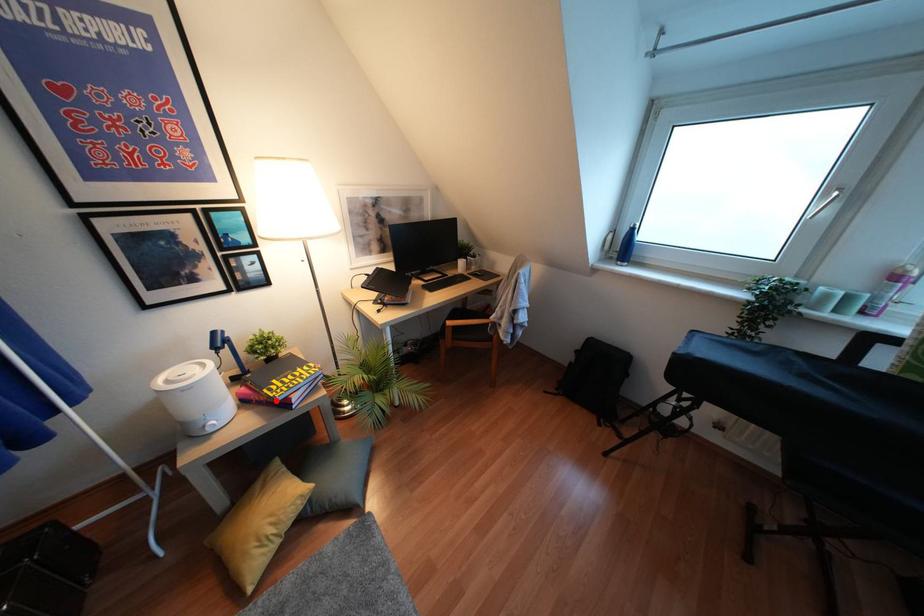
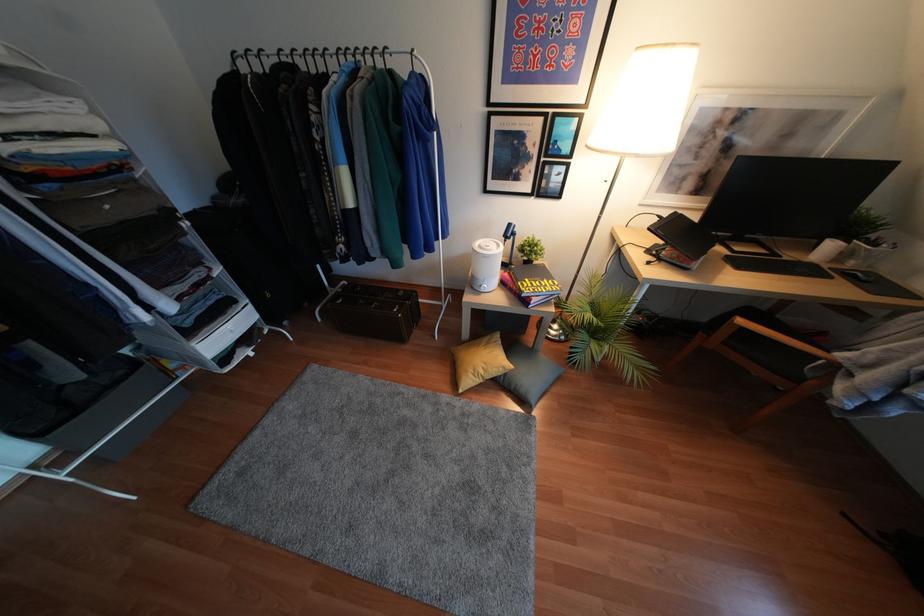
Question: I am providing you with two images of the same scene from different viewpoints. Given a red point in image1, look at the same physical point in image2. Is it:

Choices:
 (A) Closer to the viewpoint
 (B) Farther from the viewpoint

Answer: (A)